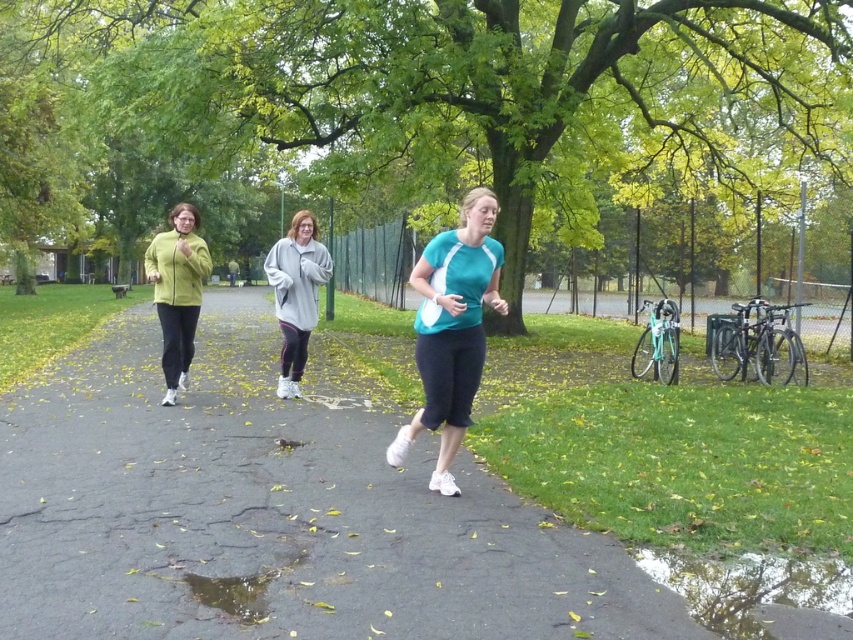
Question: Can you confirm if transparent water at lower right is positioned below matte green jacket at left?

Choices:
 (A) yes
 (B) no

Answer: (A)

Question: Which of these objects is positioned farthest from the gray fleece sweatshirt at center?

Choices:
 (A) transparent water at lower right
 (B) matte green jacket at left
 (C) teal matte shirt at center

Answer: (A)

Question: Which object is positioned closest to the teal matte shirt at center?

Choices:
 (A) transparent water at lower right
 (B) gray fleece sweatshirt at center
 (C) matte green jacket at left

Answer: (A)

Question: Among these objects, which one is farthest from the camera?

Choices:
 (A) transparent water at lower right
 (B) gray fleece sweatshirt at center
 (C) matte green jacket at left
 (D) teal matte shirt at center

Answer: (B)

Question: Does teal matte shirt at center appear over gray fleece sweatshirt at center?

Choices:
 (A) yes
 (B) no

Answer: (A)

Question: Observing the image, what is the correct spatial positioning of teal matte shirt at center in reference to gray fleece sweatshirt at center?

Choices:
 (A) right
 (B) left

Answer: (A)